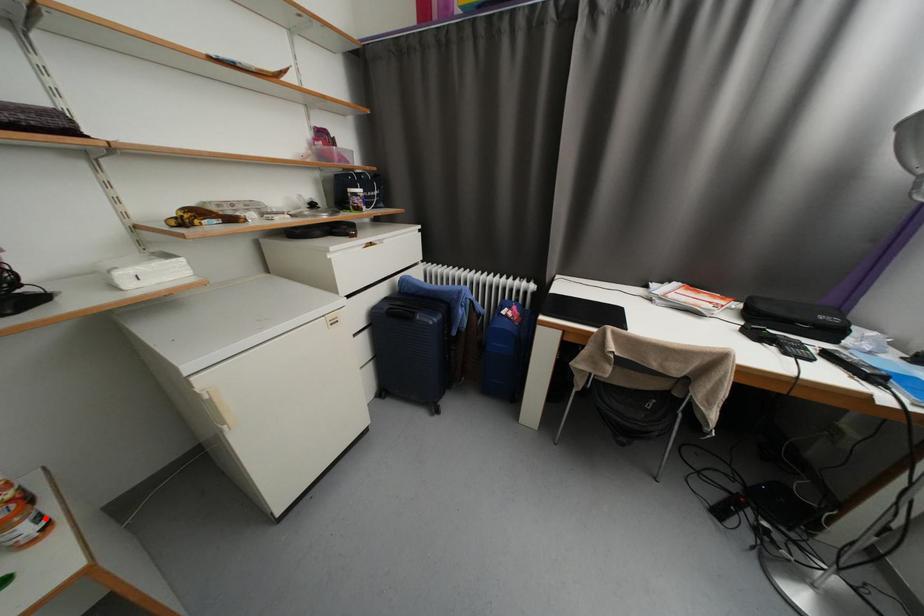
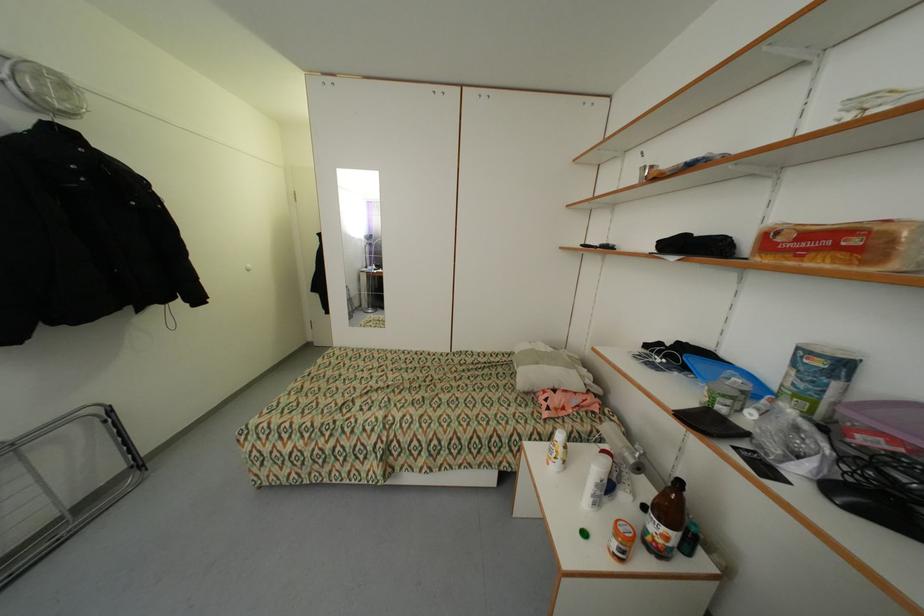
Locate, in the second image, the point that corresponds to the highlighted location in the first image.

(627, 552)